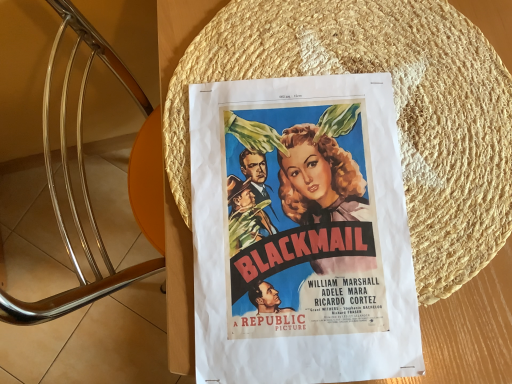
Identify the location of vacant space to the right of matte paper poster at center. (459, 215).